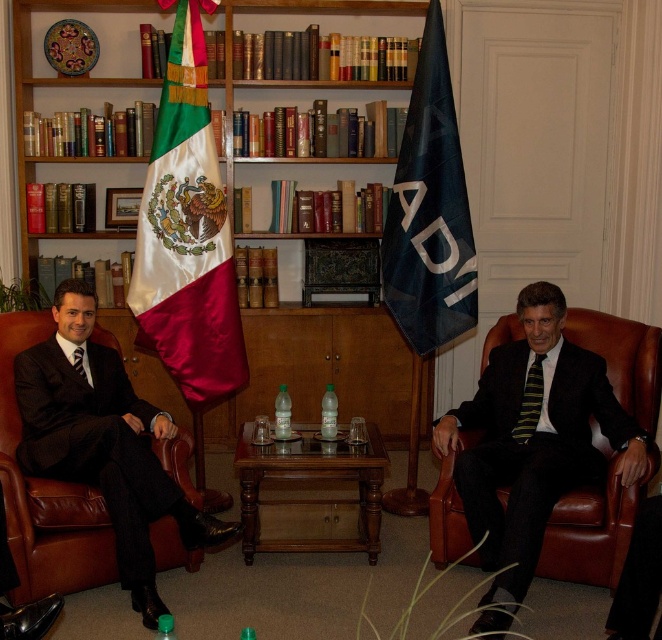
You are a tailor measuring the suits in the image. Which suit has a narrower width, the black suit at center or the dark brown leather suit at left?

The black suit at center has a narrower width than the dark brown leather suit at left.

You are a tailor who needs to determine which suit requires more fabric to alter. Based on the image, which suit would need more fabric, the black suit at center or the dark brown leather suit at left?

The black suit at center requires more fabric for alterations since it has a larger size compared to the dark brown leather suit at left.